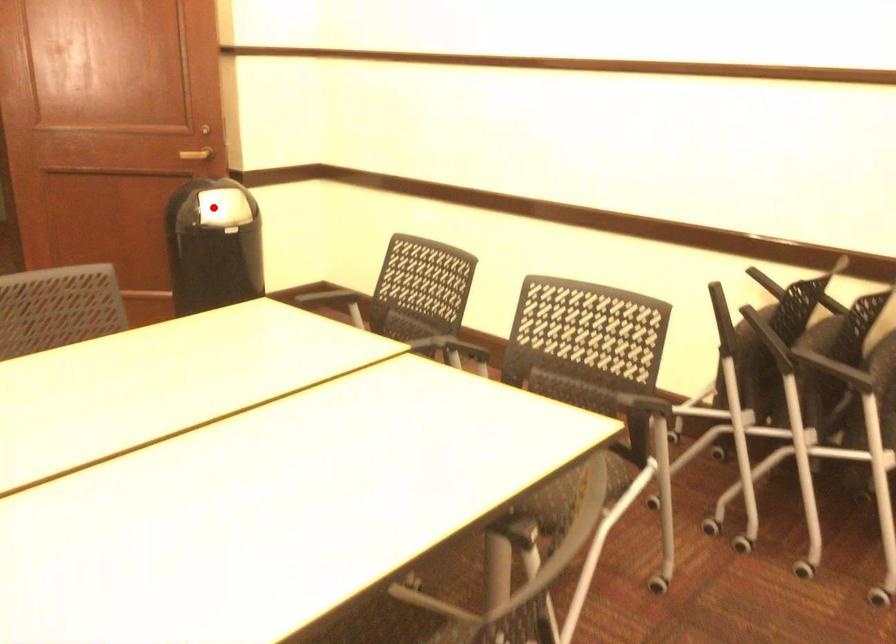
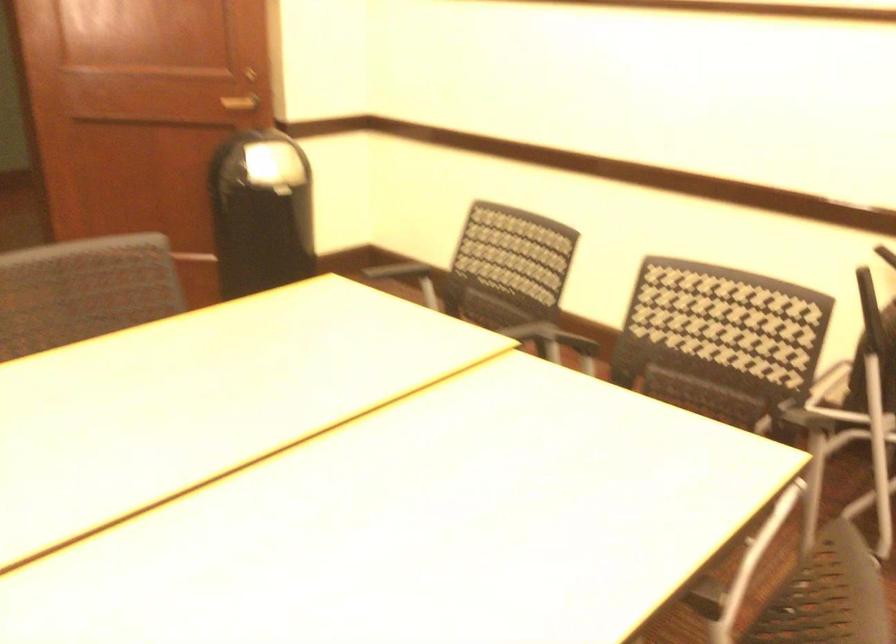
Locate, in the second image, the point that corresponds to the highlighted location in the first image.

(274, 166)